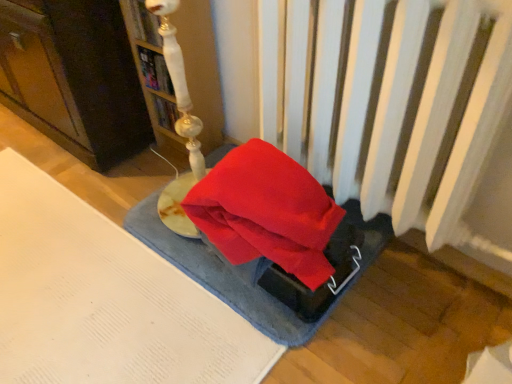
Question: Is blue textured yoga mat at center wider than matte white lamp at upper left?

Choices:
 (A) no
 (B) yes

Answer: (B)

Question: Is blue textured yoga mat at center closer to camera compared to matte white lamp at upper left?

Choices:
 (A) yes
 (B) no

Answer: (A)

Question: Is blue textured yoga mat at center thinner than matte white lamp at upper left?

Choices:
 (A) no
 (B) yes

Answer: (A)

Question: Is blue textured yoga mat at center next to matte white lamp at upper left and touching it?

Choices:
 (A) no
 (B) yes

Answer: (A)

Question: Is blue textured yoga mat at center not close to matte white lamp at upper left?

Choices:
 (A) yes
 (B) no

Answer: (B)

Question: From a real-world perspective, relative to blue textured yoga mat at center, is white glossy lamp at upper left, the 1th book when ordered from top to bottom, vertically above or below?

Choices:
 (A) below
 (B) above

Answer: (B)

Question: Relative to blue textured yoga mat at center, is white glossy lamp at upper left, acting as the 2th book starting from the bottom, in front or behind?

Choices:
 (A) behind
 (B) front

Answer: (A)

Question: Is white glossy lamp at upper left, acting as the 2th book starting from the bottom, bigger or smaller than blue textured yoga mat at center?

Choices:
 (A) small
 (B) big

Answer: (A)

Question: Is white glossy lamp at upper left, acting as the 2th book starting from the bottom, to the left or to the right of blue textured yoga mat at center in the image?

Choices:
 (A) right
 (B) left

Answer: (B)

Question: Considering their positions, is blue textured yoga mat at center located in front of or behind white glossy lamp at upper left, the 1th book when ordered from top to bottom?

Choices:
 (A) front
 (B) behind

Answer: (A)

Question: Is point (239, 284) positioned closer to the camera than point (139, 21)?

Choices:
 (A) farther
 (B) closer

Answer: (B)

Question: From a real-world perspective, is blue textured yoga mat at center above or below white glossy lamp at upper left, the 1th book when ordered from top to bottom?

Choices:
 (A) above
 (B) below

Answer: (B)

Question: Considering the positions of blue textured yoga mat at center and white glossy lamp at upper left, the 1th book when ordered from top to bottom, in the image, is blue textured yoga mat at center taller or shorter than white glossy lamp at upper left, the 1th book when ordered from top to bottom,?

Choices:
 (A) tall
 (B) short

Answer: (B)

Question: From the image's perspective, is blue textured yoga mat at center located above or below hardcover book at upper center, positioned as the 2th book in top-to-bottom order?

Choices:
 (A) below
 (B) above

Answer: (A)

Question: From a real-world perspective, is blue textured yoga mat at center above or below hardcover book at upper center, the 1th book positioned from the bottom?

Choices:
 (A) above
 (B) below

Answer: (B)